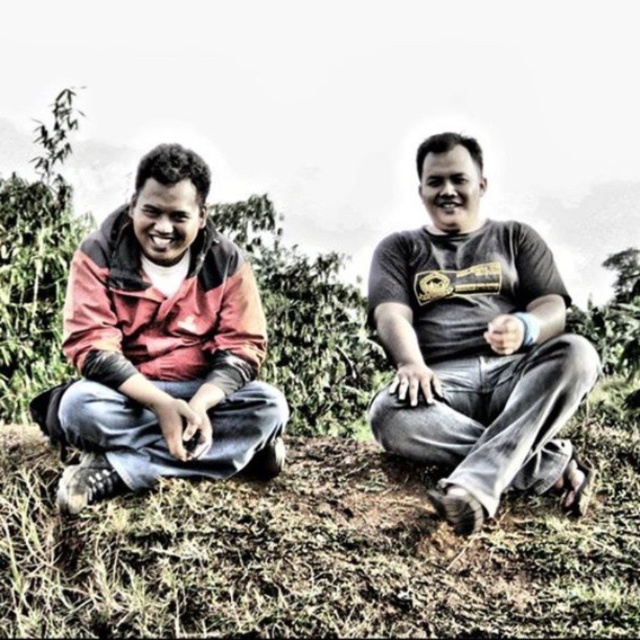
Is point (388, 474) closer to viewer compared to point (147, 408)?

No.

I want to click on green grass at center, so click(321, 548).

Can you confirm if dark gray t-shirt at center is positioned to the right of matte red jacket at left?

Yes, dark gray t-shirt at center is to the right of matte red jacket at left.

Who is shorter, dark gray t-shirt at center or matte red jacket at left?

Standing shorter between the two is matte red jacket at left.

Does point (547, 419) come behind point (262, 387)?

No, (547, 419) is closer to viewer.

This screenshot has width=640, height=640. In order to click on dark gray t-shirt at center in this screenshot , I will do `click(476, 346)`.

Locate an element on the screen. The image size is (640, 640). green grass at center is located at coordinates (321, 548).

Locate an element on the screen. The height and width of the screenshot is (640, 640). green grass at center is located at coordinates (321, 548).